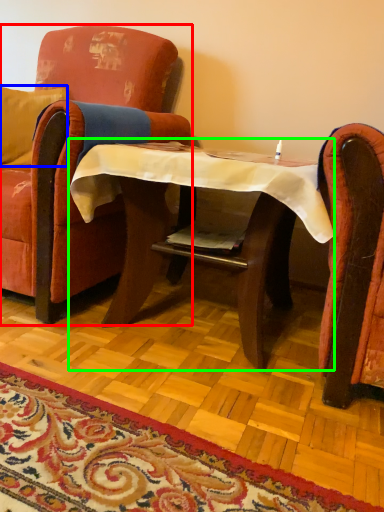
Question: Estimate the real-world distances between objects in this image. Which object is closer to chair (highlighted by a red box), pillow (highlighted by a blue box) or table (highlighted by a green box)?

Choices:
 (A) pillow
 (B) table

Answer: (B)